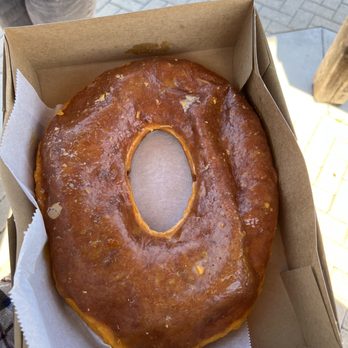
At what (x,y) coordinates should I click in order to perform the action: click on cardboard box. Please return your answer as a coordinate pair (x, y). The width and height of the screenshot is (348, 348). Looking at the image, I should click on (309, 308).